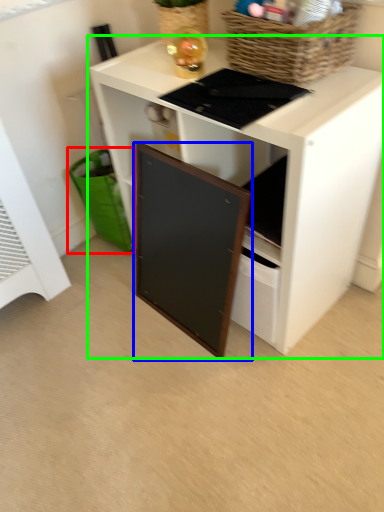
Question: Which object is the farthest from shopping basket (highlighted by a red box)? Choose among these: cabinetry (highlighted by a blue box) or desk (highlighted by a green box).

Choices:
 (A) cabinetry
 (B) desk

Answer: (B)